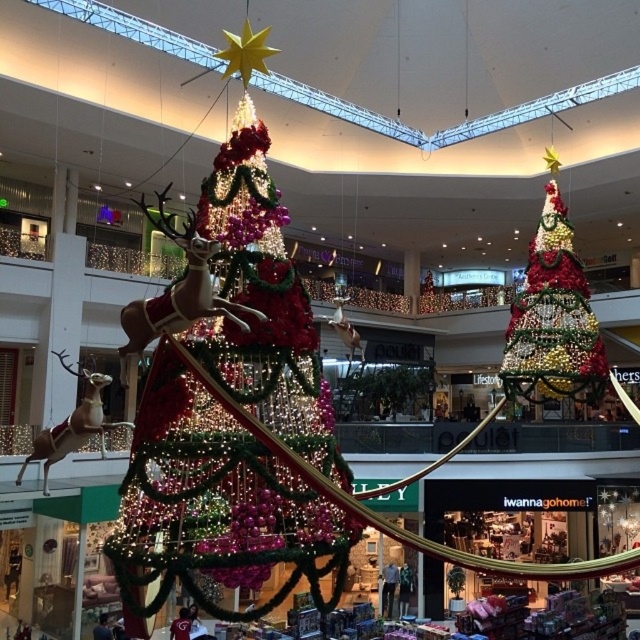
You are a visitor at the mall and want to take a photo of both the iridescent glass christmas tree at center and the shiny metallic christmas tree at upper right. Which tree should you stand closer to in order to include both in your photo without cropping?

You should stand closer to the iridescent glass christmas tree at center because it is shorter than the shiny metallic christmas tree at upper right, allowing you to frame both in the photo without cropping.

You are a store manager planning to place a new decoration between the iridescent glass christmas tree at center and the shiny metallic christmas tree at upper right. Based on their sizes, which tree should the decoration be closer to?

The iridescent glass christmas tree at center is smaller than the shiny metallic christmas tree at upper right. Therefore, the decoration should be placed closer to the shiny metallic christmas tree at upper right to maintain visual balance.

Based on the photo, you are standing in the shopping mall atrium where the festive decorations are displayed. You notice a point marked at coordinates (228, 397). Which object does this point correspond to?

The point at coordinates (228, 397) corresponds to the iridescent glass Christmas tree at center.